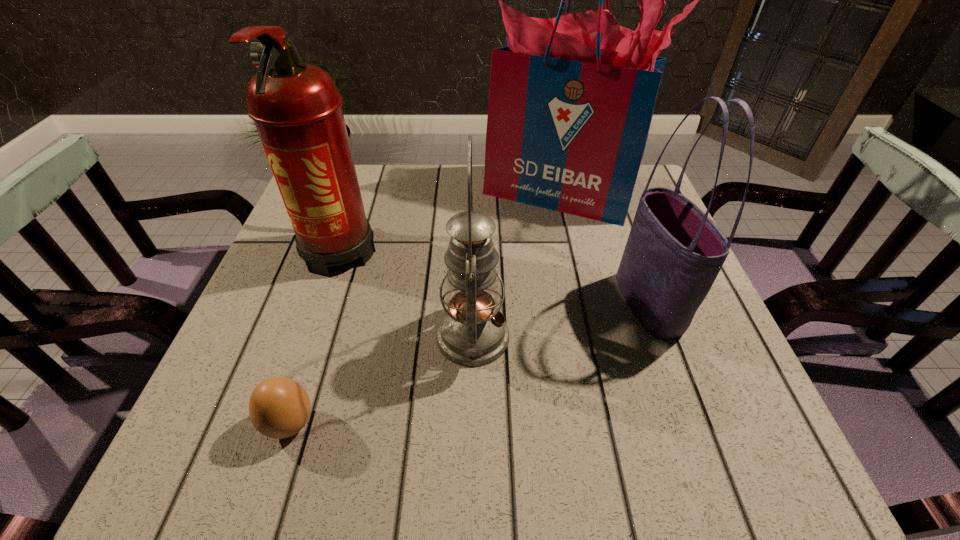
You are a GUI agent. You are given a task and a screenshot of the screen. Output one action in this format:
    pyautogui.click(x=<x>, y=<y>)
    Task: Click on the grocery bag
    This screenshot has width=960, height=540.
    Given the screenshot: What is the action you would take?
    pyautogui.click(x=571, y=99)

Find the location of a particular element. Image resolution: width=960 pixels, height=540 pixels. fire extinguisher is located at coordinates (296, 107).

Where is `tote bag`? This screenshot has width=960, height=540. tote bag is located at coordinates (674, 252).

Image resolution: width=960 pixels, height=540 pixels. I want to click on oil lamp, so click(x=472, y=332).

What are the coordinates of `boiled egg` in the screenshot? It's located at (279, 407).

This screenshot has height=540, width=960. I want to click on the shortest object, so click(x=279, y=407).

The height and width of the screenshot is (540, 960). In order to click on vacant space located 0.190m on the front-facing side of the grocery bag in this screenshot , I will do `click(577, 282)`.

Find the location of a particular element. Image resolution: width=960 pixels, height=540 pixels. free space located 0.280m on the front-facing side of the fire extinguisher is located at coordinates (283, 415).

The height and width of the screenshot is (540, 960). What are the coordinates of `vacant space located on the left of the tote bag` in the screenshot? It's located at (573, 305).

Locate an element on the screen. This screenshot has height=540, width=960. vacant space situated on the left of the oil lamp is located at coordinates (326, 336).